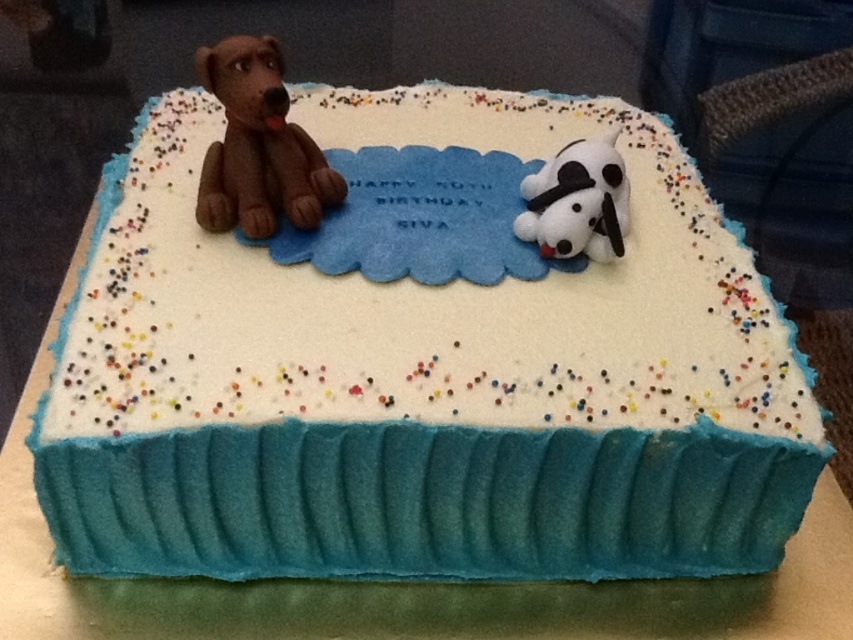
Question: Which point appears closest to the camera in this image?

Choices:
 (A) (560, 205)
 (B) (253, 122)

Answer: (B)

Question: Does matte chocolate teddy bear at left have a larger size compared to white plush dog at upper right?

Choices:
 (A) no
 (B) yes

Answer: (A)

Question: Which point is closer to the camera?

Choices:
 (A) matte chocolate teddy bear at left
 (B) white plush dog at upper right

Answer: (A)

Question: Can you confirm if matte chocolate teddy bear at left is positioned below white plush dog at upper right?

Choices:
 (A) yes
 (B) no

Answer: (B)

Question: Does matte chocolate teddy bear at left appear on the left side of white plush dog at upper right?

Choices:
 (A) no
 (B) yes

Answer: (B)